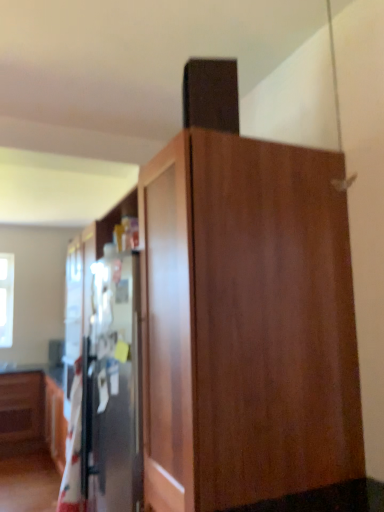
Question: Considering the relative sizes of wooden cabinet at center and white cotton blanket at left in the image provided, is wooden cabinet at center taller than white cotton blanket at left?

Choices:
 (A) yes
 (B) no

Answer: (A)

Question: From the image's perspective, is wooden cabinet at center below white cotton blanket at left?

Choices:
 (A) no
 (B) yes

Answer: (A)

Question: Can you confirm if wooden cabinet at center is bigger than white cotton blanket at left?

Choices:
 (A) no
 (B) yes

Answer: (B)

Question: Is the depth of wooden cabinet at center greater than that of white cotton blanket at left?

Choices:
 (A) no
 (B) yes

Answer: (A)

Question: From a real-world perspective, is wooden cabinet at center located beneath white cotton blanket at left?

Choices:
 (A) no
 (B) yes

Answer: (A)

Question: Visually, is white cotton blanket at left positioned to the left or to the right of wooden cabinet at center?

Choices:
 (A) right
 (B) left

Answer: (B)

Question: Is point (77, 379) closer or farther from the camera than point (334, 293)?

Choices:
 (A) farther
 (B) closer

Answer: (A)

Question: Considering their positions, is white cotton blanket at left located in front of or behind wooden cabinet at center?

Choices:
 (A) behind
 (B) front

Answer: (A)

Question: In terms of width, does white cotton blanket at left look wider or thinner when compared to wooden cabinet at center?

Choices:
 (A) wide
 (B) thin

Answer: (B)

Question: Is transparent glass window at upper left to the left or to the right of white cotton blanket at left in the image?

Choices:
 (A) left
 (B) right

Answer: (A)

Question: From the image's perspective, is transparent glass window at upper left located above or below white cotton blanket at left?

Choices:
 (A) below
 (B) above

Answer: (B)

Question: From a real-world perspective, is transparent glass window at upper left physically located above or below white cotton blanket at left?

Choices:
 (A) above
 (B) below

Answer: (A)

Question: Is transparent glass window at upper left wider or thinner than white cotton blanket at left?

Choices:
 (A) thin
 (B) wide

Answer: (A)

Question: In terms of width, does transparent glass window at upper left look wider or thinner when compared to wooden cabinet at center?

Choices:
 (A) wide
 (B) thin

Answer: (B)

Question: Considering the relative positions of transparent glass window at upper left and wooden cabinet at center in the image provided, is transparent glass window at upper left to the left or to the right of wooden cabinet at center?

Choices:
 (A) left
 (B) right

Answer: (A)